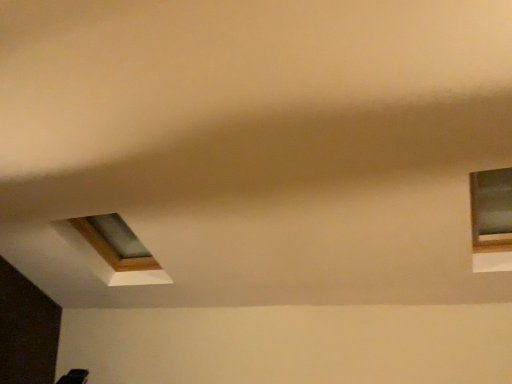
How much space does transparent glass window at upper left, which appears as the 2th window when viewed from the right, occupy vertically?

transparent glass window at upper left, which appears as the 2th window when viewed from the right, is 20.09 inches tall.

The height and width of the screenshot is (384, 512). What do you see at coordinates (115, 242) in the screenshot?
I see `transparent glass window at upper left, the 1th window positioned from the left` at bounding box center [115, 242].

Where is `transparent glass window at upper left, which is counted as the 1th window, starting from the back`? The width and height of the screenshot is (512, 384). transparent glass window at upper left, which is counted as the 1th window, starting from the back is located at coordinates (115, 242).

What do you see at coordinates (490, 210) in the screenshot? The width and height of the screenshot is (512, 384). I see `matte glass window at upper right, the second window in the left-to-right sequence` at bounding box center [490, 210].

Where is `matte glass window at upper right, the 1th window from the front`? Image resolution: width=512 pixels, height=384 pixels. matte glass window at upper right, the 1th window from the front is located at coordinates (490, 210).

Identify the location of transparent glass window at upper left, placed as the 2th window when sorted from front to back. The width and height of the screenshot is (512, 384). (115, 242).

In the image, is matte glass window at upper right, the second window in the left-to-right sequence, on the left side or the right side of transparent glass window at upper left, the 1th window positioned from the left?

matte glass window at upper right, the second window in the left-to-right sequence, is to the right of transparent glass window at upper left, the 1th window positioned from the left.

In the image, is matte glass window at upper right, which is the 2th window from back to front, positioned in front of or behind transparent glass window at upper left, which is counted as the 1th window, starting from the back?

Clearly, matte glass window at upper right, which is the 2th window from back to front, is in front of transparent glass window at upper left, which is counted as the 1th window, starting from the back.

Considering the points (507, 245) and (112, 238), which point is in front, point (507, 245) or point (112, 238)?

The point (507, 245) is more forward.

From the image's perspective, which is above, matte glass window at upper right, which is the 2th window from back to front, or transparent glass window at upper left, the 1th window positioned from the left?

From the image's view, matte glass window at upper right, which is the 2th window from back to front, is above.

In the scene shown: From a real-world perspective, which is physically below, matte glass window at upper right, the 1th window when ordered from right to left, or transparent glass window at upper left, which is counted as the 1th window, starting from the back?

transparent glass window at upper left, which is counted as the 1th window, starting from the back, is physically lower.

Looking at their sizes, would you say matte glass window at upper right, the second window in the left-to-right sequence, is wider or thinner than transparent glass window at upper left, the 1th window positioned from the left?

matte glass window at upper right, the second window in the left-to-right sequence, is wider than transparent glass window at upper left, the 1th window positioned from the left.

Between matte glass window at upper right, the 1th window when ordered from right to left, and transparent glass window at upper left, which is counted as the 1th window, starting from the back, which one has more height?

matte glass window at upper right, the 1th window when ordered from right to left.

Considering the sizes of objects matte glass window at upper right, the 1th window from the front, and transparent glass window at upper left, which appears as the 2th window when viewed from the right, in the image provided, who is smaller, matte glass window at upper right, the 1th window from the front, or transparent glass window at upper left, which appears as the 2th window when viewed from the right,?

With smaller size is matte glass window at upper right, the 1th window from the front.

Is matte glass window at upper right, which is the 2th window from back to front, situated inside transparent glass window at upper left, placed as the 2th window when sorted from front to back, or outside?

matte glass window at upper right, which is the 2th window from back to front, is outside transparent glass window at upper left, placed as the 2th window when sorted from front to back.

Can you see matte glass window at upper right, which is the 2th window from back to front, touching transparent glass window at upper left, which appears as the 2th window when viewed from the right?

matte glass window at upper right, which is the 2th window from back to front, is not next to transparent glass window at upper left, which appears as the 2th window when viewed from the right, and they're not touching.

Is matte glass window at upper right, the second window in the left-to-right sequence, oriented away from transparent glass window at upper left, which appears as the 2th window when viewed from the right?

No, matte glass window at upper right, the second window in the left-to-right sequence, is not facing away from transparent glass window at upper left, which appears as the 2th window when viewed from the right.

Measure the distance between matte glass window at upper right, which is the 2th window from back to front, and transparent glass window at upper left, placed as the 2th window when sorted from front to back.

2.81 meters.

This screenshot has height=384, width=512. I want to click on window on the left of matte glass window at upper right, the 1th window when ordered from right to left, so click(x=115, y=242).

Considering the relative positions of transparent glass window at upper left, placed as the 2th window when sorted from front to back, and matte glass window at upper right, the 1th window from the front, in the image provided, is transparent glass window at upper left, placed as the 2th window when sorted from front to back, to the left of matte glass window at upper right, the 1th window from the front, from the viewer's perspective?

Indeed, transparent glass window at upper left, placed as the 2th window when sorted from front to back, is positioned on the left side of matte glass window at upper right, the 1th window from the front.

Between transparent glass window at upper left, the 1th window positioned from the left, and matte glass window at upper right, the 1th window from the front, which one is positioned in front?

matte glass window at upper right, the 1th window from the front.

Considering the points (118, 237) and (498, 213), which point is in front, point (118, 237) or point (498, 213)?

The point (498, 213) is closer.

From the image's perspective, is transparent glass window at upper left, which appears as the 2th window when viewed from the right, below matte glass window at upper right, the 1th window from the front?

Yes.

From a real-world perspective, between transparent glass window at upper left, placed as the 2th window when sorted from front to back, and matte glass window at upper right, the 1th window from the front, who is vertically higher?

In real-world perspective, matte glass window at upper right, the 1th window from the front, is above.

Between transparent glass window at upper left, placed as the 2th window when sorted from front to back, and matte glass window at upper right, the 1th window when ordered from right to left, which one has smaller width?

Thinner between the two is transparent glass window at upper left, placed as the 2th window when sorted from front to back.

Who is taller, transparent glass window at upper left, placed as the 2th window when sorted from front to back, or matte glass window at upper right, which is the 2th window from back to front?

Standing taller between the two is matte glass window at upper right, which is the 2th window from back to front.

Considering the sizes of objects transparent glass window at upper left, the 1th window positioned from the left, and matte glass window at upper right, the second window in the left-to-right sequence, in the image provided, who is smaller, transparent glass window at upper left, the 1th window positioned from the left, or matte glass window at upper right, the second window in the left-to-right sequence,?

matte glass window at upper right, the second window in the left-to-right sequence.

Is transparent glass window at upper left, which appears as the 2th window when viewed from the right, not inside matte glass window at upper right, the 1th window from the front?

Indeed, transparent glass window at upper left, which appears as the 2th window when viewed from the right, is completely outside matte glass window at upper right, the 1th window from the front.

Is transparent glass window at upper left, which appears as the 2th window when viewed from the right, far from matte glass window at upper right, the second window in the left-to-right sequence?

Absolutely, transparent glass window at upper left, which appears as the 2th window when viewed from the right, is distant from matte glass window at upper right, the second window in the left-to-right sequence.

Is transparent glass window at upper left, placed as the 2th window when sorted from front to back, oriented away from matte glass window at upper right, the 1th window when ordered from right to left?

No, transparent glass window at upper left, placed as the 2th window when sorted from front to back, is not facing the opposite direction of matte glass window at upper right, the 1th window when ordered from right to left.

How different are the orientations of transparent glass window at upper left, which is counted as the 1th window, starting from the back, and matte glass window at upper right, the second window in the left-to-right sequence, in degrees?

8.99e-05 degrees.

How far apart are transparent glass window at upper left, which is counted as the 1th window, starting from the back, and matte glass window at upper right, the second window in the left-to-right sequence?

A distance of 2.81 meters exists between transparent glass window at upper left, which is counted as the 1th window, starting from the back, and matte glass window at upper right, the second window in the left-to-right sequence.

The image size is (512, 384). I want to click on window above the transparent glass window at upper left, which is counted as the 1th window, starting from the back (from a real-world perspective), so click(x=490, y=210).

Where is `window that is below the matte glass window at upper right, the second window in the left-to-right sequence (from the image's perspective)`? This screenshot has width=512, height=384. window that is below the matte glass window at upper right, the second window in the left-to-right sequence (from the image's perspective) is located at coordinates coord(115,242).

You are a GUI agent. You are given a task and a screenshot of the screen. Output one action in this format:
    pyautogui.click(x=<x>, y=<y>)
    Task: Click on the window located underneath the matte glass window at upper right, the 1th window from the front (from a real-world perspective)
    
    Given the screenshot: What is the action you would take?
    pyautogui.click(x=115, y=242)